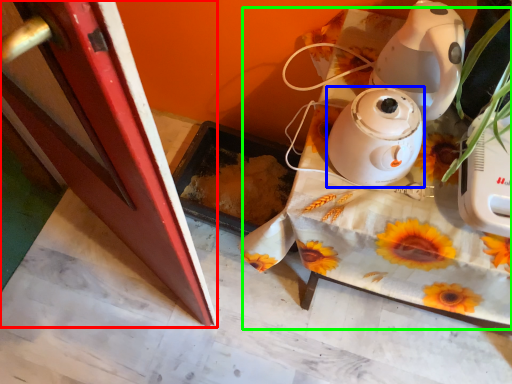
Question: Which object is the farthest from screen door (highlighted by a red box)? Choose among these: home appliance (highlighted by a blue box) or table (highlighted by a green box).

Choices:
 (A) home appliance
 (B) table

Answer: (A)